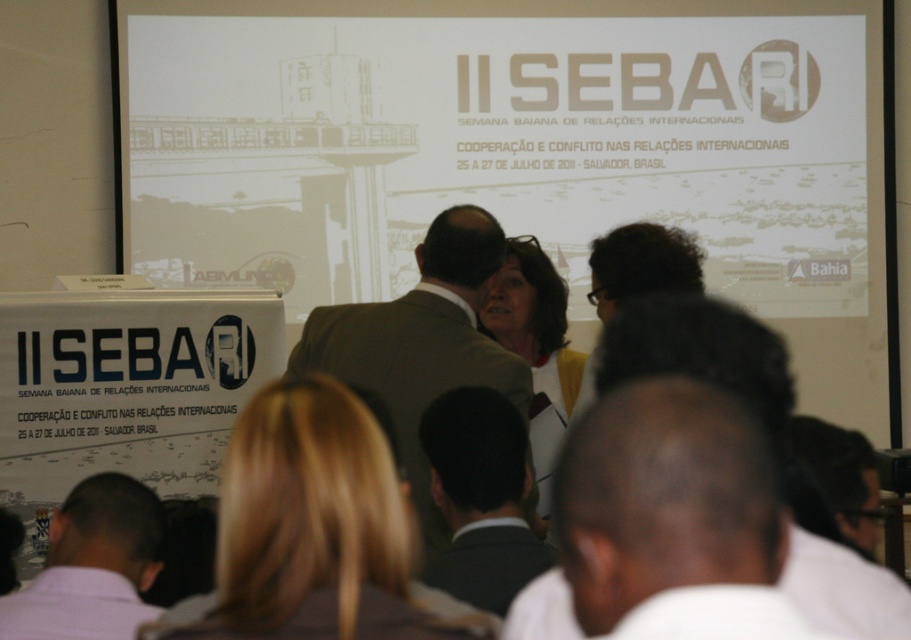
Question: Is dark hair at center to the right of yellow fabric at center from the viewer's perspective?

Choices:
 (A) yes
 (B) no

Answer: (A)

Question: Which object is the farthest from the light brown suit at center?

Choices:
 (A) dark hair at center
 (B) yellow fabric at center
 (C) dark brown suit at center

Answer: (A)

Question: Among these points, which one is farthest from the camera?

Choices:
 (A) (746, 484)
 (B) (484, 385)
 (C) (443, 634)
 (D) (128, 588)

Answer: (B)

Question: Can you confirm if light brown suit at center is bigger than dark brown suit at center?

Choices:
 (A) no
 (B) yes

Answer: (B)

Question: Does blonde hair at center appear under light brown suit at center?

Choices:
 (A) yes
 (B) no

Answer: (A)

Question: Among these points, which one is farthest from the camera?

Choices:
 (A) click(503, 586)
 (B) click(572, 352)

Answer: (B)